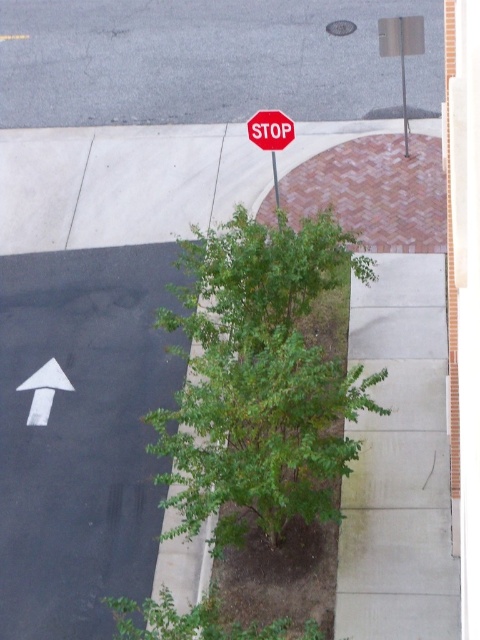
You are a pedestrian standing on the sidewalk near the tree. You need to cross the road but must first check for traffic. Since the black asphalt road to the left has a white arrow pointing upwards, which direction should you look to see if cars are coming from the direction indicated by the arrow? Also, where is the red matte stop sign at upper center located in relation to the metallic pole at center?

The white arrow on the road pointing upwards likely indicates a one way street, so you should look in the direction the arrow is pointing, which is upwards, to check for oncoming traffic. The red matte stop sign at upper center is positioned above the metallic pole at center.